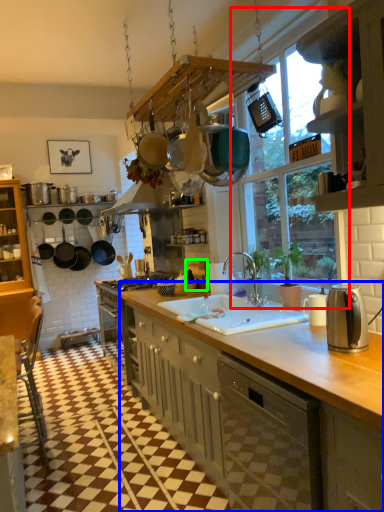
Question: Based on their relative distances, which object is farther from window (highlighted by a red box)? Choose from cabinetry (highlighted by a blue box) and appliance (highlighted by a green box).

Choices:
 (A) cabinetry
 (B) appliance

Answer: (A)